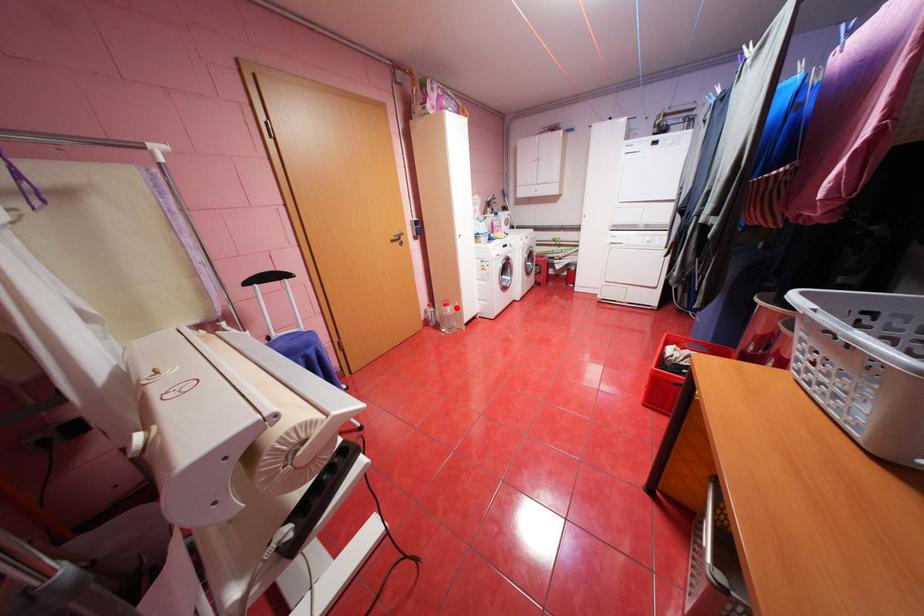
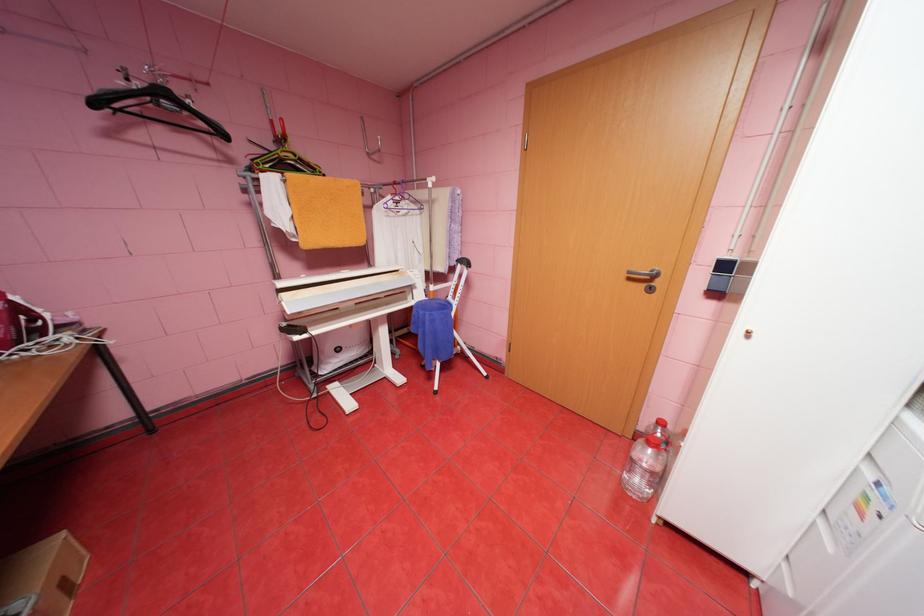
Question: I am providing you with two images of the same scene from different viewpoints. Given a red point in image1, look at the same physical point in image2. Is it:

Choices:
 (A) Closer to the viewpoint
 (B) Farther from the viewpoint

Answer: (A)